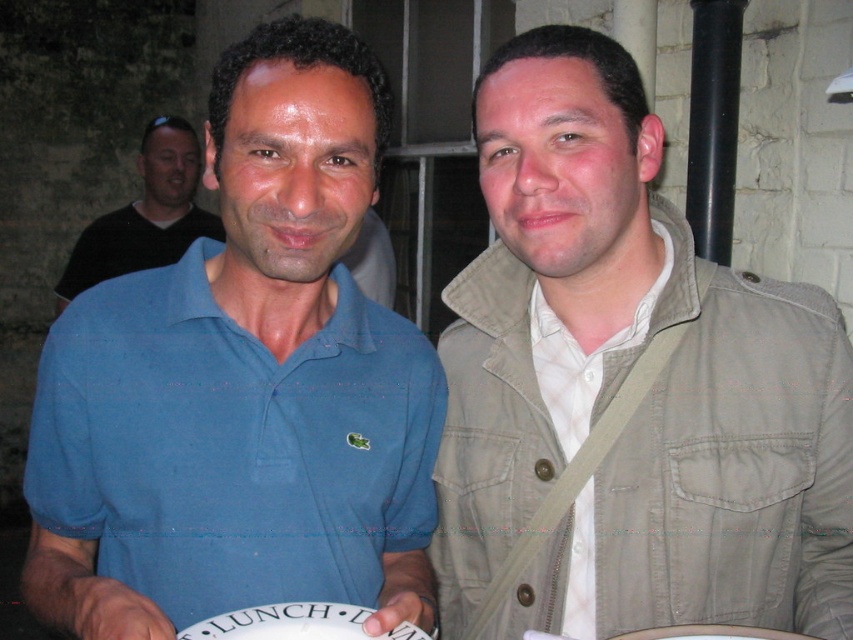
You are taking a photo of the scene described. The khaki cotton jacket at center is part of the main subject. To ensure the jacket is in focus, where should you adjust your camera focus coordinates?

The khaki cotton jacket at center is located at point [627,387], so you should adjust your camera focus coordinates to [627,387] to ensure it is in focus.

You are a photographer adjusting your camera settings to capture a clear image of the khaki cotton jacket at center. The camera has a minimum focus distance of 90 centimeters. Will the jacket be in focus?

The khaki cotton jacket at center is 93.98 centimeters away from camera, which is beyond the camera minimum focus distance of 90 centimeters. Therefore, the jacket will be in focus.